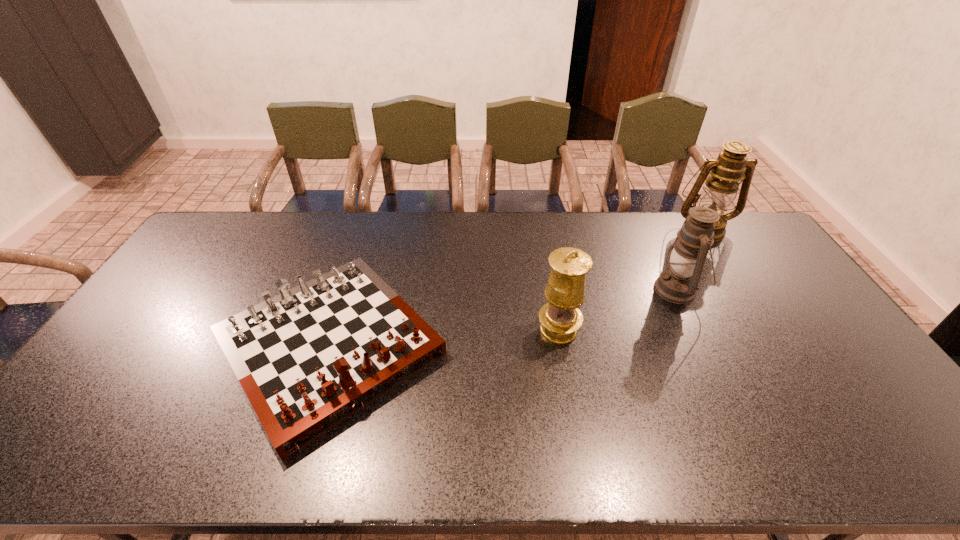
The height and width of the screenshot is (540, 960). I want to click on the farthest oil lamp, so pyautogui.click(x=732, y=165).

In order to click on the rightmost object in this screenshot , I will do `click(732, 165)`.

This screenshot has width=960, height=540. Identify the location of the second nearest oil lamp. (679, 284).

Where is `the second oil lamp from left to right`? This screenshot has height=540, width=960. the second oil lamp from left to right is located at coordinates (679, 284).

You are a GUI agent. You are given a task and a screenshot of the screen. Output one action in this format:
    pyautogui.click(x=<x>, y=<y>)
    Task: Click on the leftmost oil lamp
    
    Given the screenshot: What is the action you would take?
    pyautogui.click(x=560, y=318)

Identify the location of the nearest oil lamp. The width and height of the screenshot is (960, 540). (560, 318).

You are a GUI agent. You are given a task and a screenshot of the screen. Output one action in this format:
    pyautogui.click(x=<x>, y=<y>)
    Task: Click on the leftmost object
    Image resolution: width=960 pixels, height=540 pixels.
    Given the screenshot: What is the action you would take?
    pyautogui.click(x=309, y=358)

Find the location of a particular element. Image resolution: width=960 pixels, height=540 pixels. gameboard is located at coordinates (309, 358).

At what (x,y) coordinates should I click in order to perform the action: click on vacant area located on the right of the rightmost oil lamp. Please return your answer as a coordinate pair (x, y). Image resolution: width=960 pixels, height=540 pixels. Looking at the image, I should click on (746, 228).

Where is `vacant region located 0.400m on the left of the second nearest oil lamp`? The height and width of the screenshot is (540, 960). vacant region located 0.400m on the left of the second nearest oil lamp is located at coordinates (530, 290).